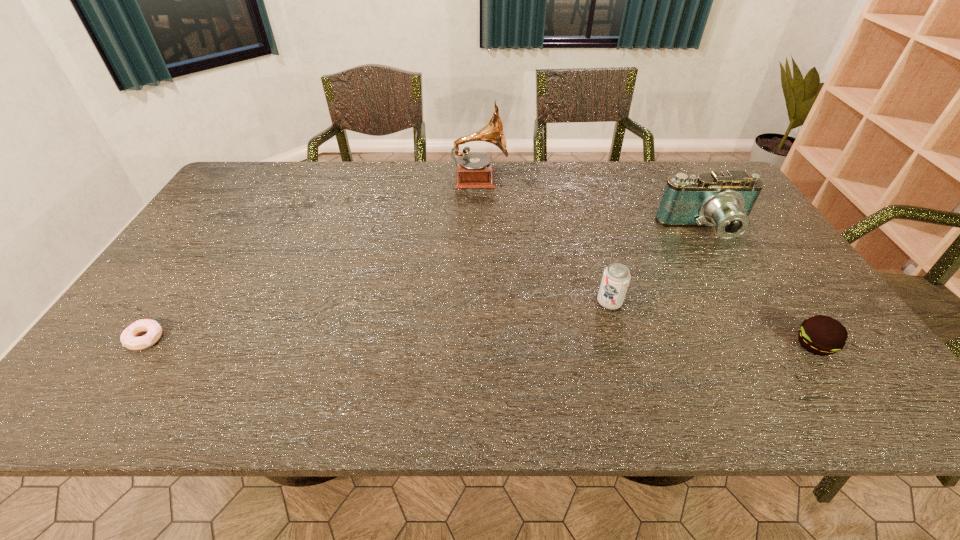
What are the coordinates of `empty space that is in between the patty and the leftmost object` in the screenshot? It's located at (480, 342).

At what (x,y) coordinates should I click in order to perform the action: click on vacant space that is in between the phonograph_record and the second tallest object. Please return your answer as a coordinate pair (x, y). This screenshot has height=540, width=960. Looking at the image, I should click on (592, 205).

The width and height of the screenshot is (960, 540). I want to click on free spot between the farthest object and the beer can, so [x=544, y=241].

Where is `object that is the second nearest to the doughnut`? This screenshot has height=540, width=960. object that is the second nearest to the doughnut is located at coordinates (615, 281).

Where is `the closest object to the fourth nearest object`? The height and width of the screenshot is (540, 960). the closest object to the fourth nearest object is located at coordinates (615, 281).

Identify the location of free point that satisfies the following two spatial constraints: 1. on the front-facing side of the second shortest object; 2. on the left side of the fourth nearest object. This screenshot has width=960, height=540. (773, 345).

At what (x,y) coordinates should I click in order to perform the action: click on free space in the image that satisfies the following two spatial constraints: 1. on the front-facing side of the patty; 2. on the left side of the camcorder. Please return your answer as a coordinate pair (x, y). This screenshot has height=540, width=960. Looking at the image, I should click on (773, 345).

At what (x,y) coordinates should I click in order to perform the action: click on free space in the image that satisfies the following two spatial constraints: 1. on the horn of the patty; 2. on the right side of the fourth object from right to left. Please return your answer as a coordinate pair (x, y). Looking at the image, I should click on (479, 345).

Identify the location of vacant space that satisfies the following two spatial constraints: 1. on the horn of the tallest object; 2. on the right side of the third object from left to right. The image size is (960, 540). (479, 302).